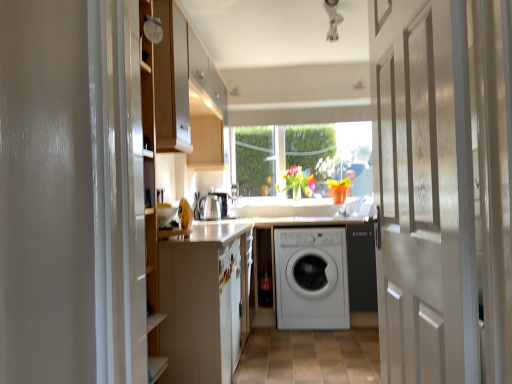
Question: Would you consider white glossy door at center to be distant from white matte cabinet at left?

Choices:
 (A) yes
 (B) no

Answer: (A)

Question: Can we say white glossy door at center lies outside white matte cabinet at left?

Choices:
 (A) no
 (B) yes

Answer: (B)

Question: Is white glossy door at center to the right of white matte cabinet at left from the viewer's perspective?

Choices:
 (A) yes
 (B) no

Answer: (A)

Question: Is white glossy door at center wider than white matte cabinet at left?

Choices:
 (A) yes
 (B) no

Answer: (B)

Question: From the image's perspective, does white glossy door at center appear higher than white matte cabinet at left?

Choices:
 (A) no
 (B) yes

Answer: (B)

Question: From the image's perspective, is white matte washing machine at center located above or below clear glass window at center?

Choices:
 (A) below
 (B) above

Answer: (A)

Question: Choose the correct answer: Is white matte washing machine at center inside clear glass window at center or outside it?

Choices:
 (A) inside
 (B) outside

Answer: (B)

Question: Looking at the image, does white matte washing machine at center seem bigger or smaller compared to clear glass window at center?

Choices:
 (A) small
 (B) big

Answer: (B)

Question: Is point (343, 269) positioned closer to the camera than point (244, 150)?

Choices:
 (A) farther
 (B) closer

Answer: (B)

Question: Is point (329, 261) closer or farther from the camera than point (198, 276)?

Choices:
 (A) closer
 (B) farther

Answer: (B)

Question: Is white matte washing machine at center spatially inside white matte cabinet at left, or outside of it?

Choices:
 (A) outside
 (B) inside

Answer: (A)

Question: From a real-world perspective, is white matte washing machine at center positioned above or below white matte cabinet at left?

Choices:
 (A) below
 (B) above

Answer: (A)

Question: From the image's perspective, is white matte washing machine at center located above or below white matte cabinet at left?

Choices:
 (A) above
 (B) below

Answer: (B)

Question: From a real-world perspective, is clear glass window at center above or below white matte washing machine at center?

Choices:
 (A) below
 (B) above

Answer: (B)

Question: From the image's perspective, relative to white matte washing machine at center, is clear glass window at center above or below?

Choices:
 (A) above
 (B) below

Answer: (A)